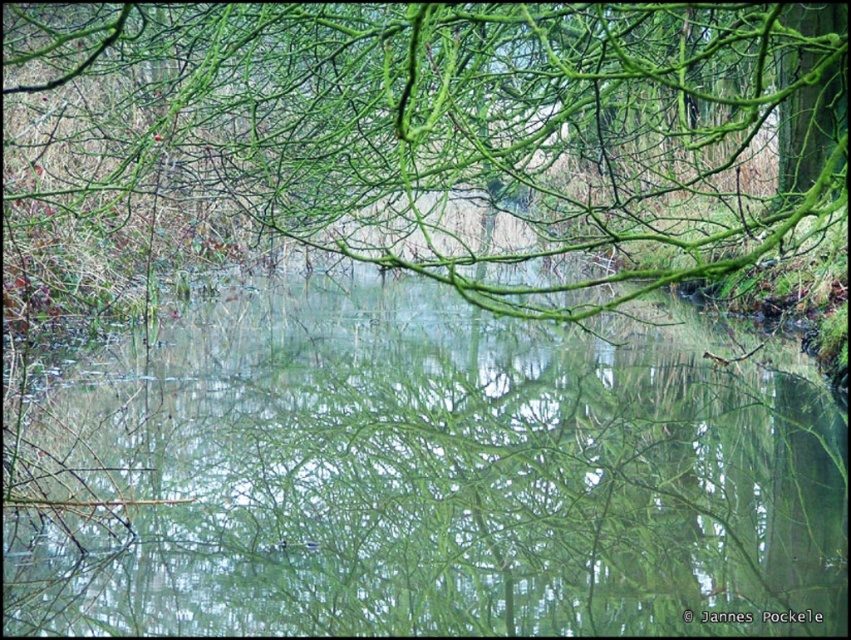
Based on the photo, does green reflective water at center have a smaller size compared to green matte branches at upper center?

Correct, green reflective water at center occupies less space than green matte branches at upper center.

Can you confirm if green reflective water at center is positioned above green matte branches at upper center?

No, green reflective water at center is not above green matte branches at upper center.

Does point (530, 534) lie behind point (330, 230)?

No.

In order to click on green reflective water at center in this screenshot , I will do 443,477.